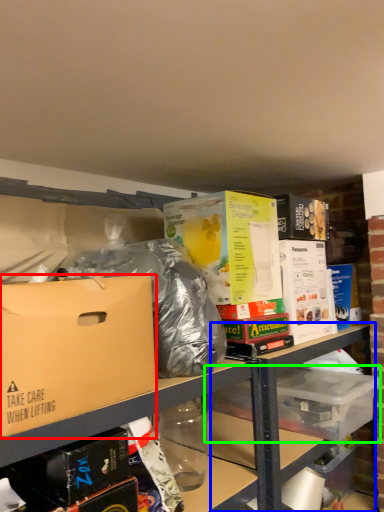
Question: Which object is the closest to the box (highlighted by a red box)? Choose among these: table (highlighted by a blue box) or storage box (highlighted by a green box).

Choices:
 (A) table
 (B) storage box

Answer: (A)